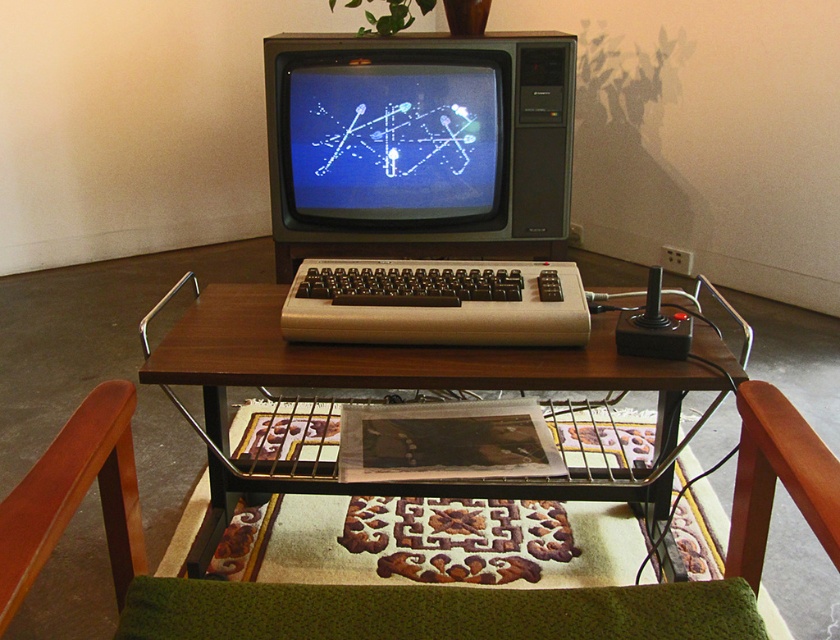
Measure the distance between point (387,184) and camera.

Point (387,184) and camera are 6.66 feet apart from each other.

Is matte black computer at center positioned before wooden table at center?

No, it is not.

In order to click on matte black computer at center in this screenshot , I will do `click(424, 188)`.